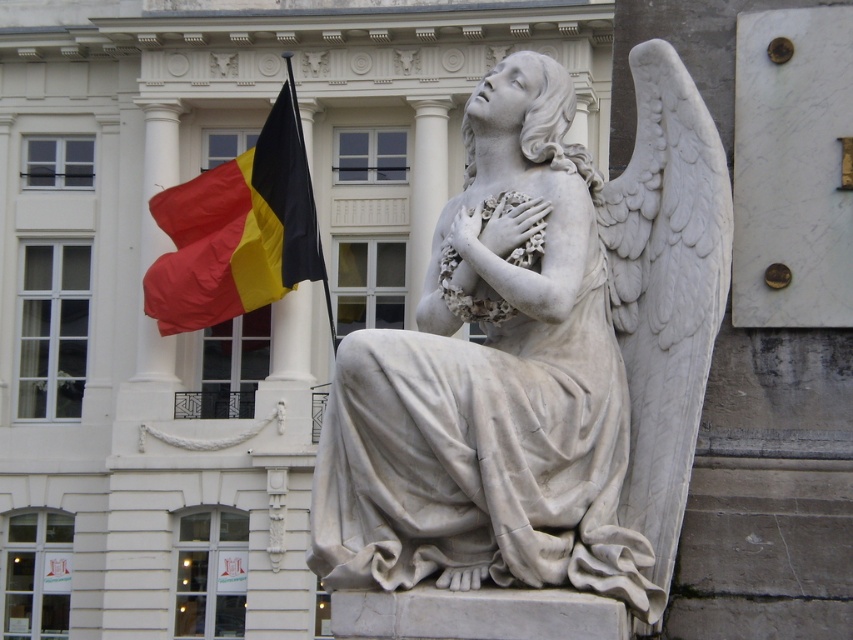
Which is below, white marble angel at center or red/yellow/black fabric flag at upper left?

white marble angel at center is lower down.

Is white marble angel at center in front of red/yellow/black fabric flag at upper left?

That is True.

This screenshot has height=640, width=853. What do you see at coordinates (538, 360) in the screenshot? I see `white marble angel at center` at bounding box center [538, 360].

Find the location of a particular element. white marble angel at center is located at coordinates (538, 360).